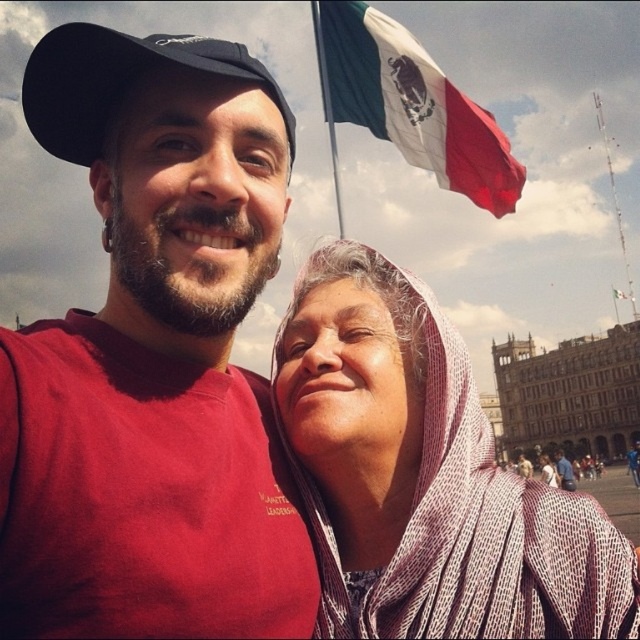
What is the color of the clothing item located at point (154,358) in the image?

The color of the clothing item at point (154,358) is matte red.